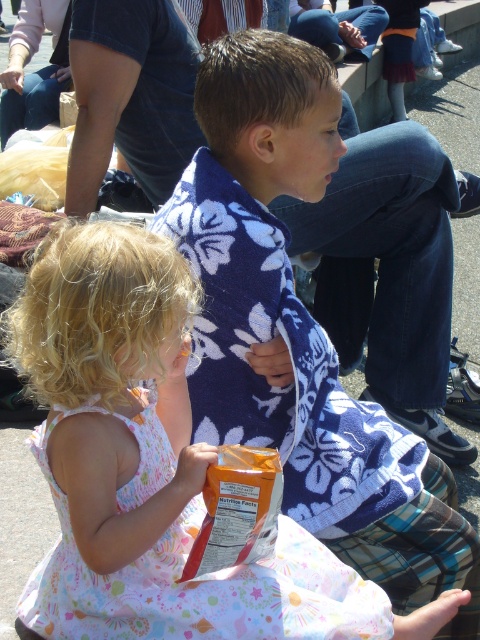
You are standing in the scene and want to reach a specific point marked at coordinates point (x=338, y=88). If you are currently 5 feet away from that point, how much farther do you need to move forward to reach it?

The distance of point (x=338, y=88) from viewer is 6.21 feet. Since you are currently 5 feet away, you need to move forward an additional 1.21 feet to reach the point.

You are standing at the point marked as point (300, 332) in the image. What object is located exactly at this point?

The blue floral towel at center is located exactly at point (300, 332).